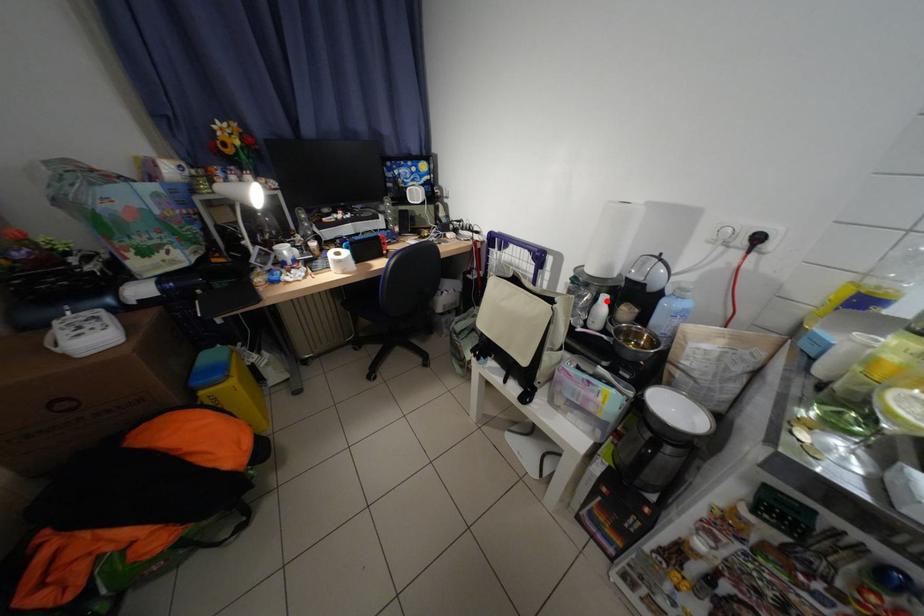
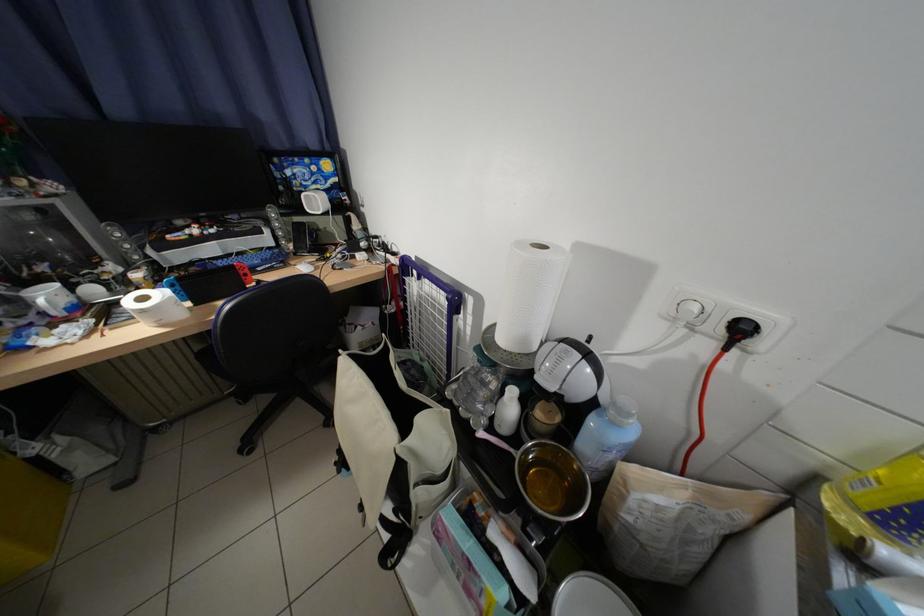
Find the pixel in the second image that matches the highlighted location in the first image.

(514, 392)